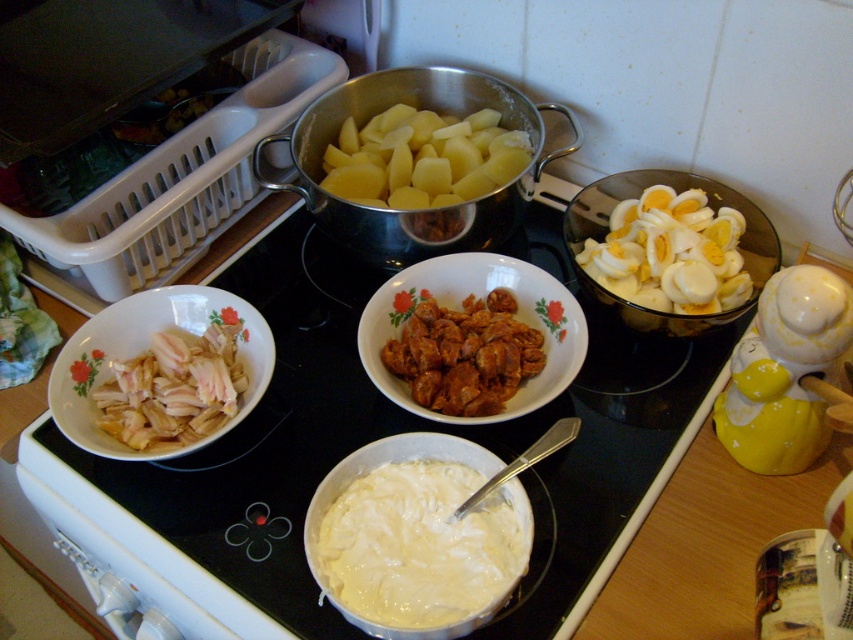
Question: Based on their relative distances, which object is farther from the white creamy sauce at center?

Choices:
 (A) white glossy bowl at lower right
 (B) black glass cooktop at center
 (C) polished stainless steel pot at center
 (D) brown crispy chicken at center

Answer: (C)

Question: Estimate the real-world distances between objects in this image. Which object is closer to the white glossy hard-boiled eggs at upper right?

Choices:
 (A) white creamy sauce at center
 (B) white glossy chicken at center
 (C) brown crispy chicken at center
 (D) black glass cooktop at center

Answer: (C)

Question: Is white glossy hard-boiled eggs at upper right smaller than white glossy chicken at center?

Choices:
 (A) no
 (B) yes

Answer: (A)

Question: Which object appears closest to the camera in this image?

Choices:
 (A) white glossy bowl at lower right
 (B) brown crispy chicken at center
 (C) white creamy sauce at center

Answer: (C)

Question: Considering the relative positions of white creamy sauce at center and white glossy chicken at center in the image provided, where is white creamy sauce at center located with respect to white glossy chicken at center?

Choices:
 (A) left
 (B) right

Answer: (B)

Question: Does black glass cooktop at center have a greater width compared to white glossy chicken at center?

Choices:
 (A) no
 (B) yes

Answer: (B)